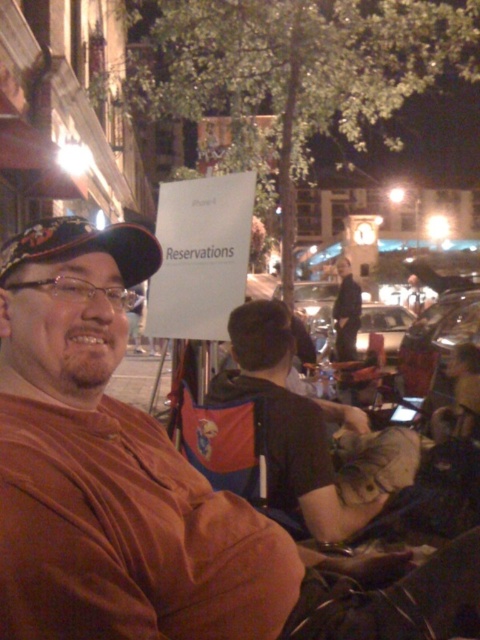
Can you confirm if brown cotton shirt at center is smaller than black fabric chair at center?

No, brown cotton shirt at center is not smaller than black fabric chair at center.

Is brown cotton shirt at center taller than black fabric chair at center?

Yes, brown cotton shirt at center is taller than black fabric chair at center.

At what (x,y) coordinates should I click in order to perform the action: click on brown cotton shirt at center. Please return your answer as a coordinate pair (x, y). Looking at the image, I should click on (145, 484).

Which is below, black fabric chair at center or dark blue suit at center?

black fabric chair at center is below.

Measure the distance between point (359,492) and camera.

The distance of point (359,492) from camera is 9.56 feet.

Locate an element on the screen. This screenshot has height=640, width=480. black fabric chair at center is located at coordinates (309, 433).

Who is more forward, (96,298) or (342,300)?

Point (96,298)

Which is behind, point (92, 424) or point (350, 355)?

Point (350, 355)

Locate an element on the screen. brown cotton shirt at center is located at coordinates (x=145, y=484).